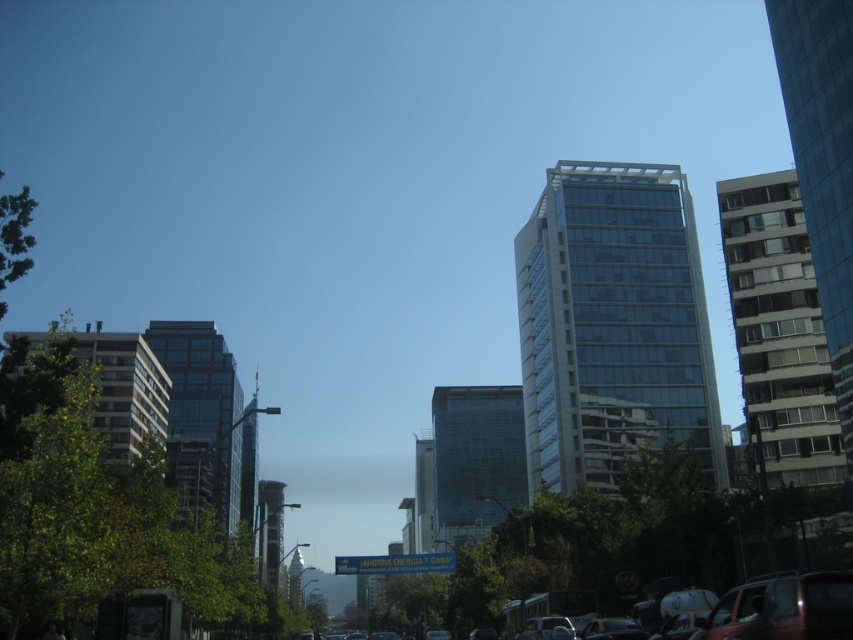
Question: Which of the following is the farthest from the observer?

Choices:
 (A) (511, 460)
 (B) (131, 432)
 (C) (672, 348)

Answer: (A)

Question: Which point appears closest to the camera in this image?

Choices:
 (A) (490, 387)
 (B) (743, 625)

Answer: (B)

Question: Is clear glass building at center to the right of white concrete building at right from the viewer's perspective?

Choices:
 (A) no
 (B) yes

Answer: (A)

Question: Does white concrete building at right appear under glassy reflective building at left?

Choices:
 (A) no
 (B) yes

Answer: (A)

Question: Which object appears farthest from the camera in this image?

Choices:
 (A) white concrete building at right
 (B) transparent glass building at center
 (C) clear glass building at center

Answer: (B)

Question: Is clear glass building at center to the left of transparent glass building at center from the viewer's perspective?

Choices:
 (A) no
 (B) yes

Answer: (A)